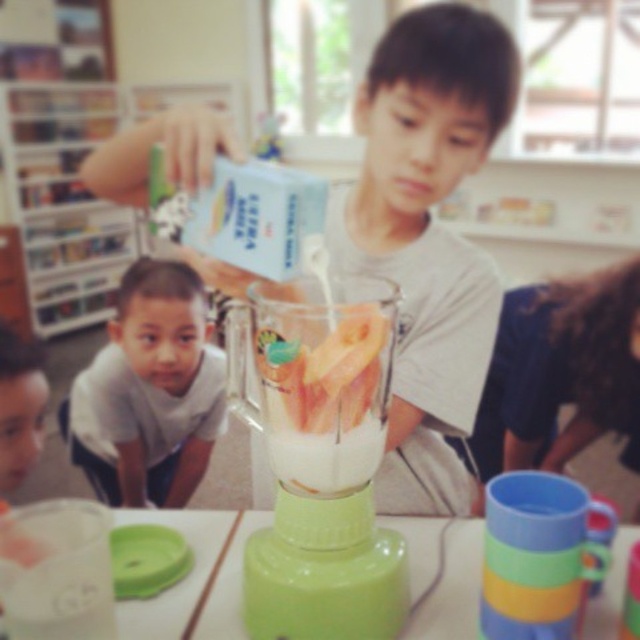
Question: Can you confirm if matte white shirt at center is positioned to the right of green plastic table at center?

Choices:
 (A) yes
 (B) no

Answer: (A)

Question: Which point is closer to the camera taking this photo?

Choices:
 (A) (189, 602)
 (B) (276, 429)
 (C) (326, 388)
 (D) (388, 285)

Answer: (C)

Question: Is green plastic blender at center thinner than green plastic table at center?

Choices:
 (A) yes
 (B) no

Answer: (A)

Question: Which of these objects is positioned farthest from the clear plastic cup at lower left?

Choices:
 (A) green plastic blender at center
 (B) white matte shirt at lower left
 (C) green plastic table at center
 (D) white matte milkshake at center

Answer: (B)

Question: Among these points, which one is nearest to the camera?

Choices:
 (A) (90, 460)
 (B) (275, 381)
 (C) (230, 602)
 (D) (51, 552)

Answer: (B)

Question: Does white matte shirt at lower left have a greater width compared to clear plastic cup at lower left?

Choices:
 (A) yes
 (B) no

Answer: (A)